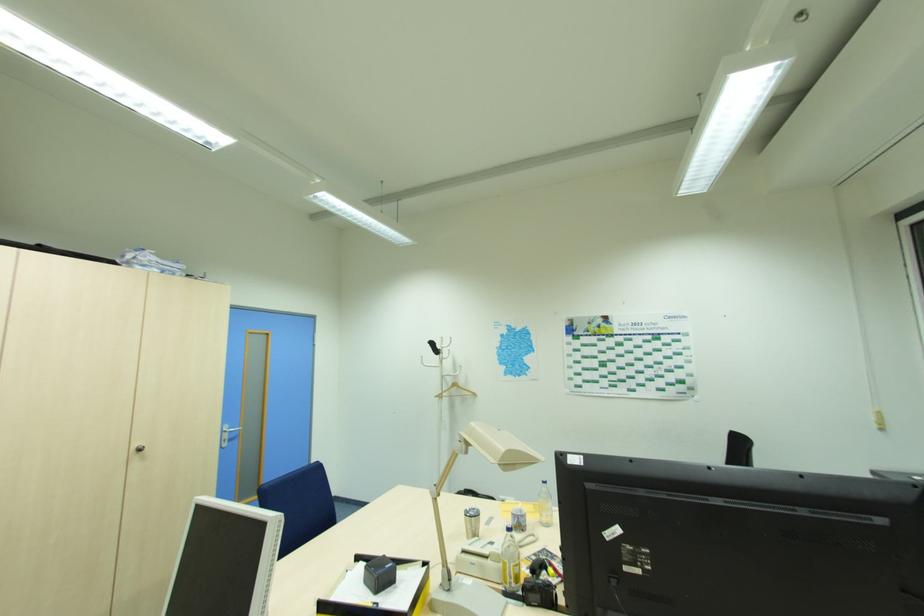
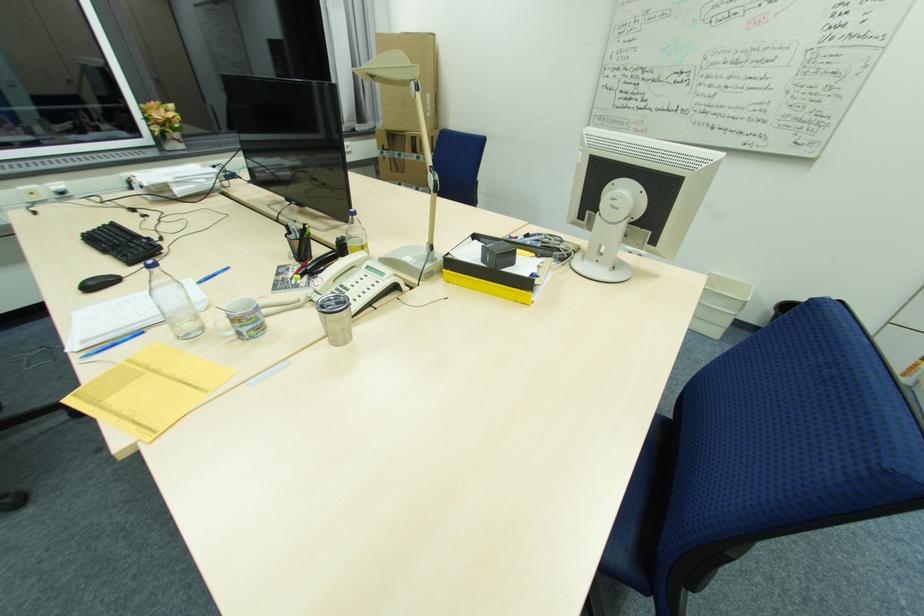
Locate, in the second image, the point that corresponds to (x=546, y=485) in the first image.

(157, 270)